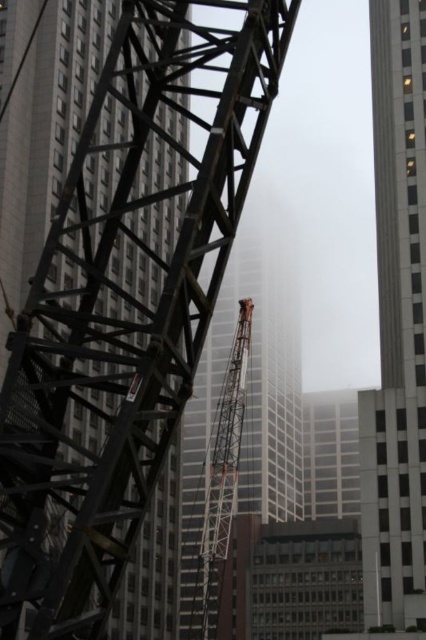
Is point (164, 282) closer to viewer compared to point (247, 346)?

Yes, it is in front of point (247, 346).

Is point (31, 564) farther from camera compared to point (226, 528)?

No.

Identify the location of metallic scaffolding at left. (97, 339).

Which is more to the right, metallic scaffolding at left or white glass skyscraper at right?

white glass skyscraper at right is more to the right.

Is point (92, 262) farther from camera compared to point (379, 24)?

No.

Where is `metallic scaffolding at left`? metallic scaffolding at left is located at coordinates (97, 339).

In order to click on metallic scaffolding at left in this screenshot , I will do `click(97, 339)`.

Does white glass skyscraper at right appear under orange metallic crane at center?

Actually, white glass skyscraper at right is above orange metallic crane at center.

Between point (402, 252) and point (213, 518), which one is positioned in front?

Point (402, 252) is in front.

Identify the location of white glass skyscraper at right. Image resolution: width=426 pixels, height=640 pixels. (397, 321).